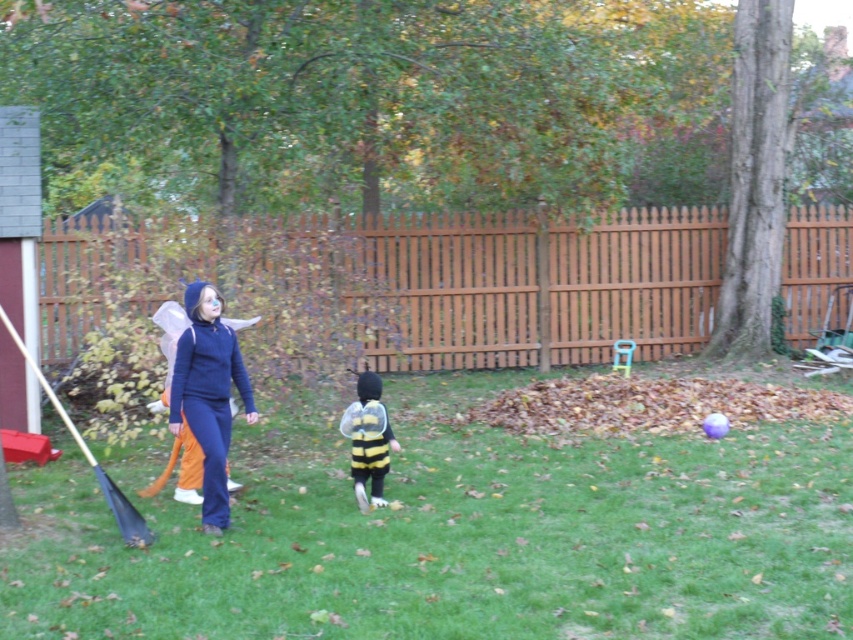
You are a photographer trying to capture both the blue fleece jacket at center and the yellow and black fabric bee costume at center in a single photo. Which one should you adjust the camera focus to prioritize if you want the taller object to be in focus first?

The blue fleece jacket at center is taller than the yellow and black fabric bee costume at center, so you should prioritize focusing on the blue fleece jacket at center first to ensure it is in focus.

You are organizing a costume party and need to arrange these two costumes in a display case. The display case has a width of 1.2 meters. The blue fleece jacket at center and the yellow and black fabric bee costume at center must be placed side by side. Given their sizes, will both costumes fit within the display case?

The blue fleece jacket at center is wider than the yellow and black fabric bee costume at center. If the combined width of both costumes exceeds 1.2 meters, they won